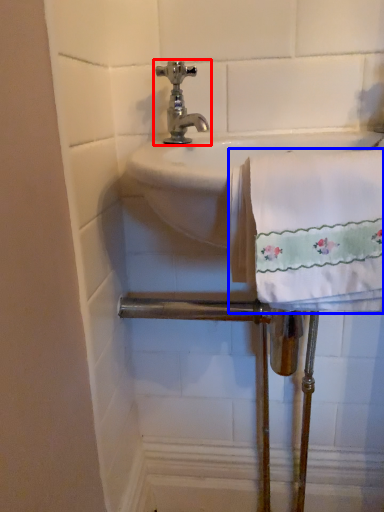
Question: Which object appears farthest to the camera in this image, tap (highlighted by a red box) or bath towel (highlighted by a blue box)?

Choices:
 (A) tap
 (B) bath towel

Answer: (A)